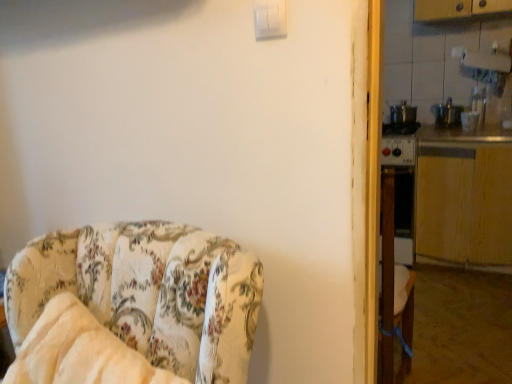
Measure the distance between wooden at right, which appears as the first counter top when ordered from the bottom, and camera.

7.47 feet.

Image resolution: width=512 pixels, height=384 pixels. Identify the location of white plastic light switch at upper center. (270, 19).

The height and width of the screenshot is (384, 512). What do you see at coordinates (270, 19) in the screenshot? I see `white plastic light switch at upper center` at bounding box center [270, 19].

Locate an element on the screen. The height and width of the screenshot is (384, 512). floral fabric chair at left is located at coordinates (132, 306).

From the image's perspective, is metallic silver counter top at right, which ranks as the second counter top in bottom-to-top order, located above or below floral fabric chair at left?

From the image's perspective, metallic silver counter top at right, which ranks as the second counter top in bottom-to-top order, appears above floral fabric chair at left.

Based on the photo, considering the sizes of metallic silver counter top at right, which appears as the first counter top when viewed from the top, and floral fabric chair at left in the image, is metallic silver counter top at right, which appears as the first counter top when viewed from the top, bigger or smaller than floral fabric chair at left?

Considering their sizes, metallic silver counter top at right, which appears as the first counter top when viewed from the top, takes up less space than floral fabric chair at left.

Considering the positions of objects metallic silver counter top at right, which ranks as the second counter top in bottom-to-top order, and floral fabric chair at left in the image provided, who is behind, metallic silver counter top at right, which ranks as the second counter top in bottom-to-top order, or floral fabric chair at left?

metallic silver counter top at right, which ranks as the second counter top in bottom-to-top order.

Is metallic silver counter top at right, which appears as the first counter top when viewed from the top, thinner than floral fabric chair at left?

No.

From the image's perspective, between floral fabric chair at left and metallic silver counter top at right, which ranks as the second counter top in bottom-to-top order, which one is located above?

metallic silver counter top at right, which ranks as the second counter top in bottom-to-top order, appears higher in the image.

Is floral fabric chair at left touching metallic silver counter top at right, which ranks as the second counter top in bottom-to-top order?

They are not placed beside each other.

Would you say floral fabric chair at left is outside metallic silver counter top at right, which appears as the first counter top when viewed from the top?

Yes.

Considering the relative positions of floral fabric chair at left and metallic silver counter top at right, which ranks as the second counter top in bottom-to-top order, in the image provided, is floral fabric chair at left to the right of metallic silver counter top at right, which ranks as the second counter top in bottom-to-top order, from the viewer's perspective?

No.

Who is more distant, floral fabric chair at left or white plastic light switch at upper center?

Positioned behind is white plastic light switch at upper center.

This screenshot has height=384, width=512. I want to click on light switch that is above the floral fabric chair at left (from the image's perspective), so click(x=270, y=19).

Is point (186, 354) farther from viewer compared to point (279, 4)?

No, it is not.

Could white plastic light switch at upper center be considered to be inside floral fabric chair at left?

No, white plastic light switch at upper center is located outside of floral fabric chair at left.

Is white plastic light switch at upper center oriented towards wooden at right, placed as the 2th counter top when sorted from top to bottom?

No, white plastic light switch at upper center is not turned towards wooden at right, placed as the 2th counter top when sorted from top to bottom.

From the image's perspective, which one is positioned higher, white plastic light switch at upper center or wooden at right, which appears as the first counter top when ordered from the bottom?

white plastic light switch at upper center appears higher in the image.

Is point (277, 17) positioned after point (490, 152)?

No, (277, 17) is closer to viewer.

In the image, is white plastic light switch at upper center positioned in front of or behind wooden at right, placed as the 2th counter top when sorted from top to bottom?

Clearly, white plastic light switch at upper center is in front of wooden at right, placed as the 2th counter top when sorted from top to bottom.

At what (x,y) coordinates should I click in order to perform the action: click on chair below the wooden at right, which appears as the first counter top when ordered from the bottom (from the image's perspective). Please return your answer as a coordinate pair (x, y). The height and width of the screenshot is (384, 512). Looking at the image, I should click on (132, 306).

Who is more distant, floral fabric chair at left or wooden at right, which appears as the first counter top when ordered from the bottom?

wooden at right, which appears as the first counter top when ordered from the bottom, is further from the camera.

What's the angular difference between floral fabric chair at left and wooden at right, placed as the 2th counter top when sorted from top to bottom,'s facing directions?

The angle between the facing direction of floral fabric chair at left and the facing direction of wooden at right, placed as the 2th counter top when sorted from top to bottom, is 2.71 degrees.

Considering the positions of points (64, 348) and (424, 247), is point (64, 348) closer to camera compared to point (424, 247)?

Yes, it is in front of point (424, 247).

Find the location of a particular element. light switch that is on the left side of wooden at right, which appears as the first counter top when ordered from the bottom is located at coordinates (270, 19).

Is wooden at right, which appears as the first counter top when ordered from the bottom, facing towards white plastic light switch at upper center?

Yes.

Considering the relative sizes of wooden at right, which appears as the first counter top when ordered from the bottom, and white plastic light switch at upper center in the image provided, is wooden at right, which appears as the first counter top when ordered from the bottom, thinner than white plastic light switch at upper center?

In fact, wooden at right, which appears as the first counter top when ordered from the bottom, might be wider than white plastic light switch at upper center.

Measure the distance between wooden at right, which appears as the first counter top when ordered from the bottom, and white plastic light switch at upper center.

wooden at right, which appears as the first counter top when ordered from the bottom, and white plastic light switch at upper center are 1.89 meters apart from each other.

Is point (277, 35) closer to viewer compared to point (473, 132)?

Yes, it is in front of point (473, 132).

Consider the image. Can you confirm if white plastic light switch at upper center is shorter than metallic silver counter top at right, which appears as the first counter top when viewed from the top?

No.

Looking at this image, can you see white plastic light switch at upper center touching metallic silver counter top at right, which appears as the first counter top when viewed from the top?

No, white plastic light switch at upper center is not beside metallic silver counter top at right, which appears as the first counter top when viewed from the top.

Locate an element on the screen. chair lying on the left of metallic silver counter top at right, which appears as the first counter top when viewed from the top is located at coordinates (132, 306).

Locate an element on the screen. This screenshot has height=384, width=512. the 1st counter top counting from the right of the floral fabric chair at left is located at coordinates (464, 134).

Considering their positions, is metallic silver counter top at right, which ranks as the second counter top in bottom-to-top order, positioned further to floral fabric chair at left than white plastic light switch at upper center?

Based on the image, metallic silver counter top at right, which ranks as the second counter top in bottom-to-top order, appears to be further to floral fabric chair at left.

When comparing their distances from wooden at right, which appears as the first counter top when ordered from the bottom, does floral fabric chair at left or white plastic light switch at upper center seem closer?

white plastic light switch at upper center is positioned closer to the anchor wooden at right, which appears as the first counter top when ordered from the bottom.

Based on their spatial positions, is metallic silver counter top at right, which ranks as the second counter top in bottom-to-top order, or floral fabric chair at left further from wooden at right, which appears as the first counter top when ordered from the bottom?

Among the two, floral fabric chair at left is located further to wooden at right, which appears as the first counter top when ordered from the bottom.

Looking at the image, which one is located further to wooden at right, which appears as the first counter top when ordered from the bottom, white plastic light switch at upper center or metallic silver counter top at right, which ranks as the second counter top in bottom-to-top order?

white plastic light switch at upper center is positioned further to the anchor wooden at right, which appears as the first counter top when ordered from the bottom.

Based on their spatial positions, is wooden at right, placed as the 2th counter top when sorted from top to bottom, or floral fabric chair at left further from white plastic light switch at upper center?

wooden at right, placed as the 2th counter top when sorted from top to bottom, lies further to white plastic light switch at upper center than the other object.

From the image, which object appears to be nearer to white plastic light switch at upper center, wooden at right, placed as the 2th counter top when sorted from top to bottom, or metallic silver counter top at right, which ranks as the second counter top in bottom-to-top order?

wooden at right, placed as the 2th counter top when sorted from top to bottom, is closer to white plastic light switch at upper center.

From the image, which object appears to be nearer to white plastic light switch at upper center, floral fabric chair at left or wooden at right, which appears as the first counter top when ordered from the bottom?

Based on the image, floral fabric chair at left appears to be nearer to white plastic light switch at upper center.

Looking at the image, which one is located closer to floral fabric chair at left, white plastic light switch at upper center or metallic silver counter top at right, which appears as the first counter top when viewed from the top?

The object closer to floral fabric chair at left is white plastic light switch at upper center.

The image size is (512, 384). Find the location of `counter top between floral fabric chair at left and metallic silver counter top at right, which ranks as the second counter top in bottom-to-top order, along the z-axis`. counter top between floral fabric chair at left and metallic silver counter top at right, which ranks as the second counter top in bottom-to-top order, along the z-axis is located at coordinates (464, 196).

You are a GUI agent. You are given a task and a screenshot of the screen. Output one action in this format:
    pyautogui.click(x=<x>, y=<y>)
    Task: Click on the counter top positioned between white plastic light switch at upper center and metallic silver counter top at right, which appears as the first counter top when viewed from the top, from near to far
    
    Given the screenshot: What is the action you would take?
    pos(464,196)

This screenshot has height=384, width=512. I want to click on light switch located between floral fabric chair at left and wooden at right, which appears as the first counter top when ordered from the bottom, in the depth direction, so click(270, 19).

What are the coordinates of `light switch positioned between floral fabric chair at left and metallic silver counter top at right, which appears as the first counter top when viewed from the top, from near to far` in the screenshot? It's located at (270, 19).